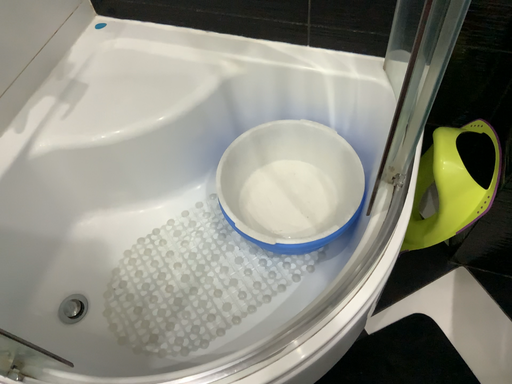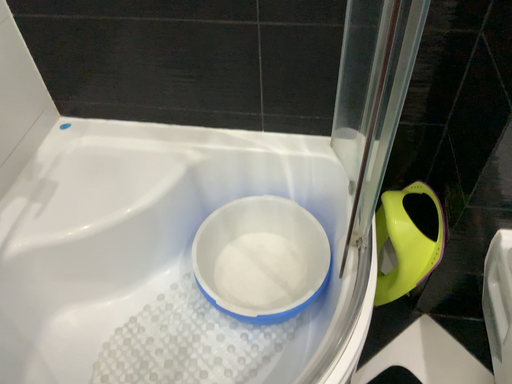
Question: Which way did the camera rotate in the video?

Choices:
 (A) rotated downward
 (B) rotated upward

Answer: (B)